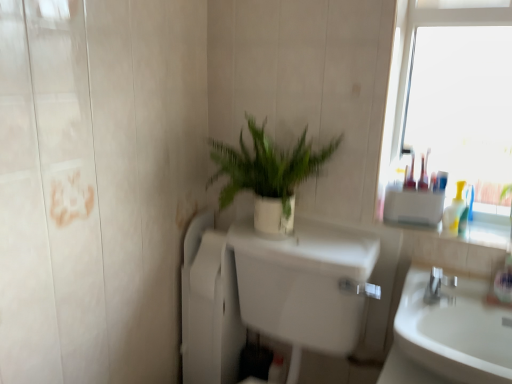
Question: Is white matte plant pot at center positioned with its back to translucent plastic bottles at right?

Choices:
 (A) no
 (B) yes

Answer: (A)

Question: Does white matte plant pot at center have a larger size compared to translucent plastic bottles at right?

Choices:
 (A) no
 (B) yes

Answer: (B)

Question: From the image's perspective, does white matte plant pot at center appear lower than translucent plastic bottles at right?

Choices:
 (A) yes
 (B) no

Answer: (B)

Question: Is white matte plant pot at center taller than translucent plastic bottles at right?

Choices:
 (A) no
 (B) yes

Answer: (B)

Question: Is white matte plant pot at center behind translucent plastic bottles at right?

Choices:
 (A) yes
 (B) no

Answer: (B)

Question: From the image's perspective, is white matte plant pot at center positioned above or below white glossy toilet at center?

Choices:
 (A) below
 (B) above

Answer: (B)

Question: Is point (247, 155) positioned closer to the camera than point (291, 281)?

Choices:
 (A) farther
 (B) closer

Answer: (A)

Question: Looking at their shapes, would you say white matte plant pot at center is wider or thinner than white glossy toilet at center?

Choices:
 (A) thin
 (B) wide

Answer: (A)

Question: Is white matte plant pot at center in front of or behind white glossy toilet at center in the image?

Choices:
 (A) behind
 (B) front

Answer: (A)

Question: Based on their sizes in the image, would you say silver metallic faucet at right is bigger or smaller than white matte plant pot at center?

Choices:
 (A) big
 (B) small

Answer: (B)

Question: From the image's perspective, is silver metallic faucet at right positioned above or below white matte plant pot at center?

Choices:
 (A) below
 (B) above

Answer: (A)

Question: From their relative heights in the image, would you say silver metallic faucet at right is taller or shorter than white matte plant pot at center?

Choices:
 (A) short
 (B) tall

Answer: (A)

Question: Is point (434, 289) closer or farther from the camera than point (284, 228)?

Choices:
 (A) closer
 (B) farther

Answer: (A)

Question: Is white matte plant pot at center taller or shorter than translucent plastic bottles at right?

Choices:
 (A) tall
 (B) short

Answer: (A)

Question: From the image's perspective, is white matte plant pot at center located above or below translucent plastic bottles at right?

Choices:
 (A) below
 (B) above

Answer: (B)